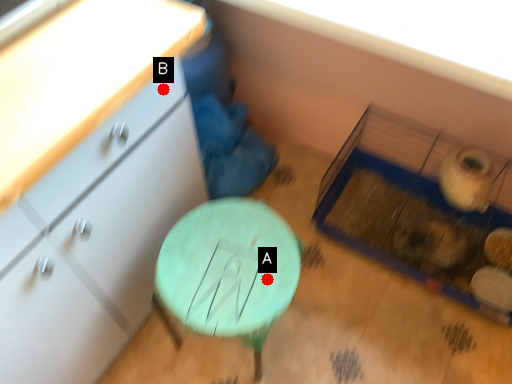
Question: Two points are circled on the image, labeled by A and B beside each circle. Which point is closer to the camera?

Choices:
 (A) A is closer
 (B) B is closer

Answer: (B)